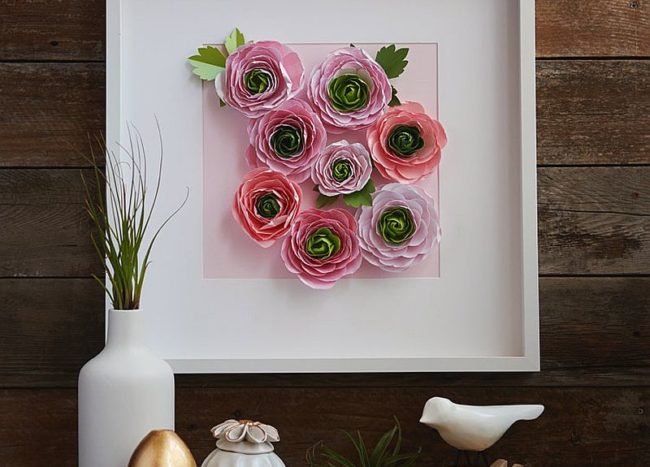
At what (x,y) coordinates should I click in order to perform the action: click on decorations. Please return your answer as a coordinate pair (x, y). This screenshot has width=650, height=467. Looking at the image, I should click on (254, 452), (169, 453).